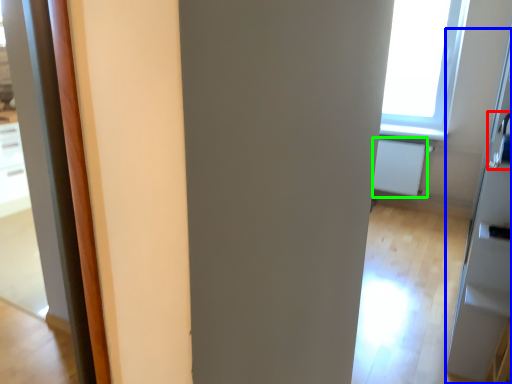
Question: Estimate the real-world distances between objects in this image. Which object is farther from door handle (highlighted by a red box), screen door (highlighted by a blue box) or radiator (highlighted by a green box)?

Choices:
 (A) screen door
 (B) radiator

Answer: (A)